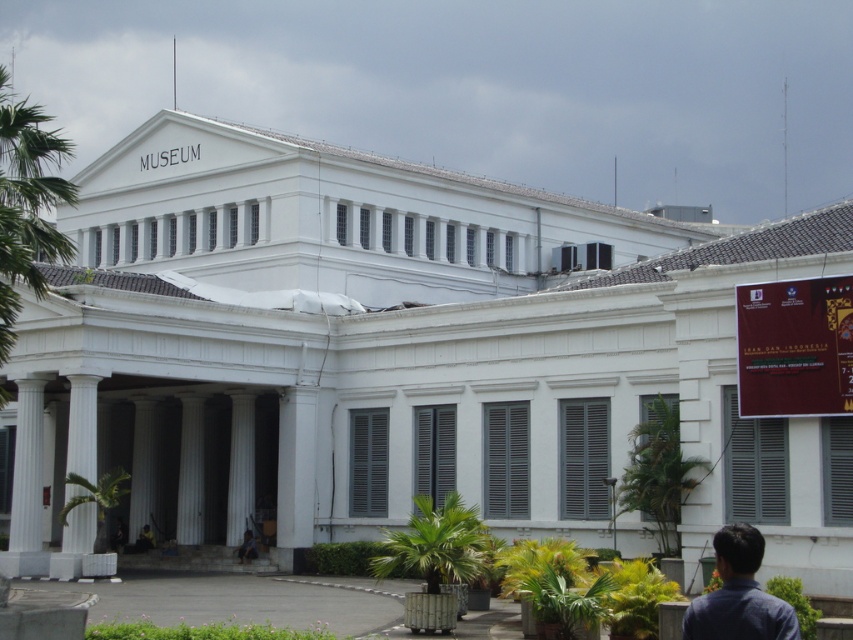
Is green leafy palm tree at center positioned in front of blue denim shirt at lower right?

No, green leafy palm tree at center is further to the viewer.

Who is more forward, [659,529] or [717,556]?

Point [717,556] is more forward.

Between point (675, 413) and point (717, 612), which one is positioned in front?

Point (717, 612)

This screenshot has width=853, height=640. Find the location of `green leafy palm tree at center`. green leafy palm tree at center is located at coordinates (659, 472).

Is white marble column at left thinner than white marble column at center?

Incorrect, white marble column at left's width is not less than white marble column at center's.

In the scene shown: Is white marble column at left wider than white marble column at center?

Answer: Yes, white marble column at left is wider than white marble column at center.

Where is `white marble column at left`? white marble column at left is located at coordinates (82, 426).

Identify the location of white marble column at left. This screenshot has width=853, height=640. (82, 426).

Between blue denim shirt at lower right and green leafy palm tree at lower left, which one has more height?

green leafy palm tree at lower left

Which is behind, point (782, 625) or point (115, 480)?

Point (115, 480)

Find the location of a particular element. Image resolution: width=853 pixels, height=640 pixels. blue denim shirt at lower right is located at coordinates (738, 595).